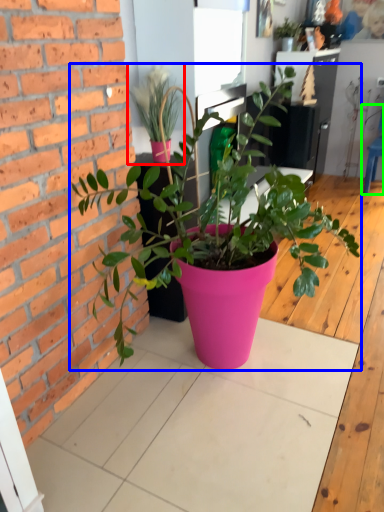
Question: Which object is the closest to the houseplant (highlighted by a red box)? Choose among these: houseplant (highlighted by a blue box) or chair (highlighted by a green box).

Choices:
 (A) houseplant
 (B) chair

Answer: (A)